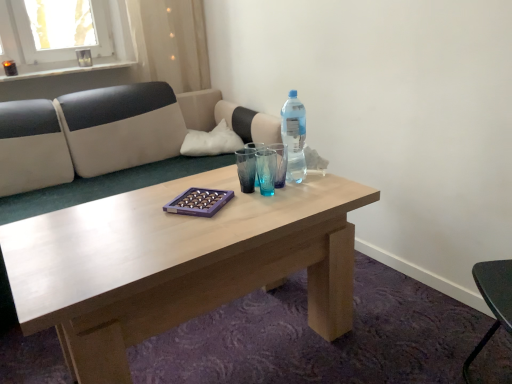
What do you see at coordinates (84, 57) in the screenshot? I see `transparent glass vase at upper left` at bounding box center [84, 57].

At what (x,y) coordinates should I click in order to perform the action: click on transparent glass vase at upper left. Please return your answer as a coordinate pair (x, y). Image resolution: width=512 pixels, height=384 pixels. Looking at the image, I should click on (84, 57).

This screenshot has height=384, width=512. In order to click on transparent plastic bottle at center in this screenshot , I will do `click(269, 166)`.

What do you see at coordinates (211, 141) in the screenshot? Image resolution: width=512 pixels, height=384 pixels. I see `white fabric pillow at upper center` at bounding box center [211, 141].

What do you see at coordinates (177, 263) in the screenshot?
I see `light brown wood coffee table at center` at bounding box center [177, 263].

Find the location of a particular element. transparent glass vase at upper left is located at coordinates (84, 57).

Find the location of a particular element. This screenshot has height=384, width=512. mineral water below the transparent glass vase at upper left (from the image's perspective) is located at coordinates (269, 166).

Considering the positions of objects transparent plastic bottle at center and transparent glass vase at upper left in the image provided, who is behind, transparent plastic bottle at center or transparent glass vase at upper left?

transparent glass vase at upper left is further away from the camera.

Between point (277, 154) and point (87, 61), which one is positioned in front?

The point (277, 154) is closer.

From a real-world perspective, is transparent glass vase at upper left on white fabric pillow at upper center?

Yes.

Between transparent glass vase at upper left and white fabric pillow at upper center, which one appears on the left side from the viewer's perspective?

transparent glass vase at upper left.

From the picture: Is transparent glass vase at upper left outside of white fabric pillow at upper center?

That's correct, transparent glass vase at upper left is outside of white fabric pillow at upper center.

Considering the relative sizes of transparent glass vase at upper left and white fabric pillow at upper center in the image provided, is transparent glass vase at upper left shorter than white fabric pillow at upper center?

Yes.

Consider the image. Is translucent plastic bottle at center to the right of transparent plastic bottle at center from the viewer's perspective?

Indeed, translucent plastic bottle at center is positioned on the right side of transparent plastic bottle at center.

You are a GUI agent. You are given a task and a screenshot of the screen. Output one action in this format:
    pyautogui.click(x=<x>, y=<y>)
    Task: Click on the mineral water in front of the translucent plastic bottle at center
    Image resolution: width=512 pixels, height=384 pixels.
    Given the screenshot: What is the action you would take?
    pyautogui.click(x=269, y=166)

Considering the sizes of translucent plastic bottle at center and transparent plastic bottle at center in the image, is translucent plastic bottle at center bigger or smaller than transparent plastic bottle at center?

Clearly, translucent plastic bottle at center is larger in size than transparent plastic bottle at center.

Does light brown wood coffee table at center turn towards white fabric pillow at upper center?

No, light brown wood coffee table at center is not facing towards white fabric pillow at upper center.

Is light brown wood coffee table at center at the left side of white fabric pillow at upper center?

No, light brown wood coffee table at center is not to the left of white fabric pillow at upper center.

Is light brown wood coffee table at center not inside white fabric pillow at upper center?

That's correct, light brown wood coffee table at center is outside of white fabric pillow at upper center.

Can you confirm if translucent plastic bottle at center is thinner than white fabric pillow at upper center?

Yes, translucent plastic bottle at center is thinner than white fabric pillow at upper center.

Is translucent plastic bottle at center situated inside white fabric pillow at upper center or outside?

translucent plastic bottle at center is not inside white fabric pillow at upper center, it's outside.

Can you tell me how much translucent plastic bottle at center and white fabric pillow at upper center differ in facing direction?

The facing directions of translucent plastic bottle at center and white fabric pillow at upper center are 1.16 degrees apart.

Is translucent plastic bottle at center taller or shorter than white fabric pillow at upper center?

In the image, translucent plastic bottle at center appears to be taller than white fabric pillow at upper center.

Is transparent glass vase at upper left outside of light brown wood coffee table at center?

Indeed, transparent glass vase at upper left is completely outside light brown wood coffee table at center.

Who is more distant, transparent glass vase at upper left or light brown wood coffee table at center?

transparent glass vase at upper left is further away from the camera.

Considering the sizes of transparent glass vase at upper left and light brown wood coffee table at center in the image, is transparent glass vase at upper left wider or thinner than light brown wood coffee table at center?

In the image, transparent glass vase at upper left appears to be more narrow than light brown wood coffee table at center.

Who is smaller, transparent glass vase at upper left or light brown wood coffee table at center?

transparent glass vase at upper left.

Between translucent plastic bottle at center and transparent glass vase at upper left, which one appears on the left side from the viewer's perspective?

Positioned to the left is transparent glass vase at upper left.

Does point (296, 148) lie behind point (88, 55)?

No.

How many degrees apart are the facing directions of translucent plastic bottle at center and transparent glass vase at upper left?

1.25 degrees separate the facing orientations of translucent plastic bottle at center and transparent glass vase at upper left.

Considering the sizes of objects translucent plastic bottle at center and transparent glass vase at upper left in the image provided, who is wider, translucent plastic bottle at center or transparent glass vase at upper left?

With larger width is translucent plastic bottle at center.

What are the coordinates of `mineral water on the right side of transparent glass vase at upper left` in the screenshot? It's located at (269, 166).

Where is `pillow lying in front of the transparent glass vase at upper left`? pillow lying in front of the transparent glass vase at upper left is located at coordinates (211, 141).

Estimate the real-world distances between objects in this image. Which object is closer to light brown wood coffee table at center, transparent glass vase at upper left or transparent plastic bottle at center?

transparent plastic bottle at center is closer to light brown wood coffee table at center.

When comparing their distances from white fabric pillow at upper center, does light brown wood coffee table at center or transparent plastic bottle at center seem further?

Among the two, light brown wood coffee table at center is located further to white fabric pillow at upper center.

Looking at the image, which one is located further to transparent plastic bottle at center, white fabric pillow at upper center or light brown wood coffee table at center?

white fabric pillow at upper center is further to transparent plastic bottle at center.

Looking at the image, which one is located further to translucent plastic bottle at center, transparent plastic bottle at center or transparent glass vase at upper left?

transparent glass vase at upper left is positioned further to the anchor translucent plastic bottle at center.

Based on their spatial positions, is light brown wood coffee table at center or transparent glass vase at upper left further from transparent plastic bottle at center?

The object further to transparent plastic bottle at center is transparent glass vase at upper left.

Considering their positions, is transparent glass vase at upper left positioned closer to translucent plastic bottle at center than white fabric pillow at upper center?

The object closer to translucent plastic bottle at center is white fabric pillow at upper center.

Estimate the real-world distances between objects in this image. Which object is closer to translucent plastic bottle at center, transparent plastic bottle at center or light brown wood coffee table at center?

The object closer to translucent plastic bottle at center is transparent plastic bottle at center.

Based on the photo, when comparing their distances from light brown wood coffee table at center, does translucent plastic bottle at center or transparent plastic bottle at center seem further?

translucent plastic bottle at center lies further to light brown wood coffee table at center than the other object.

Where is `pillow between translucent plastic bottle at center and transparent glass vase at upper left in the front-back direction`? The image size is (512, 384). pillow between translucent plastic bottle at center and transparent glass vase at upper left in the front-back direction is located at coordinates (211, 141).

Find the location of a particular element. bottle located between light brown wood coffee table at center and transparent glass vase at upper left in the depth direction is located at coordinates (294, 137).

Locate an element on the screen. bottle between transparent plastic bottle at center and transparent glass vase at upper left in the front-back direction is located at coordinates (294, 137).

What are the coordinates of `bottle positioned between light brown wood coffee table at center and white fabric pillow at upper center from near to far` in the screenshot? It's located at (294, 137).